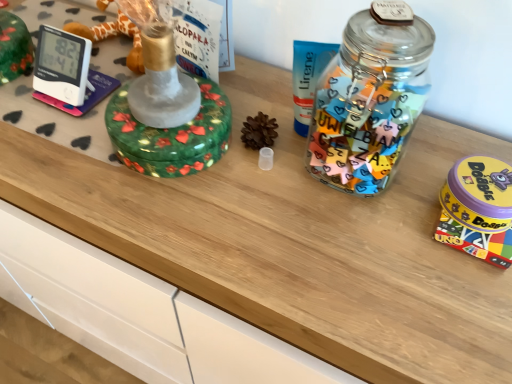
Question: In terms of height, does transparent plastic pinecone at center, marked as the 1th toy in a left-to-right arrangement, look taller or shorter compared to yellow plastic game at right, the 2th toy when ordered from left to right?

Choices:
 (A) tall
 (B) short

Answer: (A)

Question: Relative to yellow plastic game at right, the 2th toy when ordered from left to right, is transparent plastic pinecone at center, arranged as the second toy when viewed from the right, in front or behind?

Choices:
 (A) front
 (B) behind

Answer: (B)

Question: In the image, is transparent plastic pinecone at center, arranged as the second toy when viewed from the right, on the left side or the right side of yellow plastic game at right, the 1th toy when ordered from right to left?

Choices:
 (A) left
 (B) right

Answer: (A)

Question: Looking at the image, does yellow plastic game at right, the 1th toy when ordered from right to left, seem bigger or smaller compared to transparent plastic pinecone at center, marked as the 1th toy in a left-to-right arrangement?

Choices:
 (A) small
 (B) big

Answer: (B)

Question: Is yellow plastic game at right, the 1th toy when ordered from right to left, taller or shorter than transparent plastic pinecone at center, marked as the 1th toy in a left-to-right arrangement?

Choices:
 (A) short
 (B) tall

Answer: (A)

Question: From the image's perspective, is yellow plastic game at right, the 2th toy when ordered from left to right, above or below transparent plastic pinecone at center, marked as the 1th toy in a left-to-right arrangement?

Choices:
 (A) above
 (B) below

Answer: (B)

Question: Is yellow plastic game at right, the 1th toy when ordered from right to left, situated inside transparent plastic pinecone at center, arranged as the second toy when viewed from the right, or outside?

Choices:
 (A) inside
 (B) outside

Answer: (B)